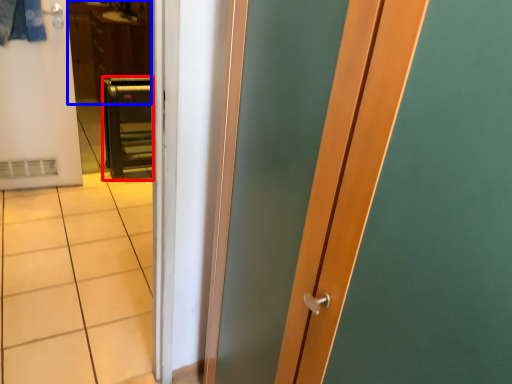
Question: Among these objects, which one is farthest to the camera, furniture (highlighted by a red box) or dresser (highlighted by a blue box)?

Choices:
 (A) furniture
 (B) dresser

Answer: (B)